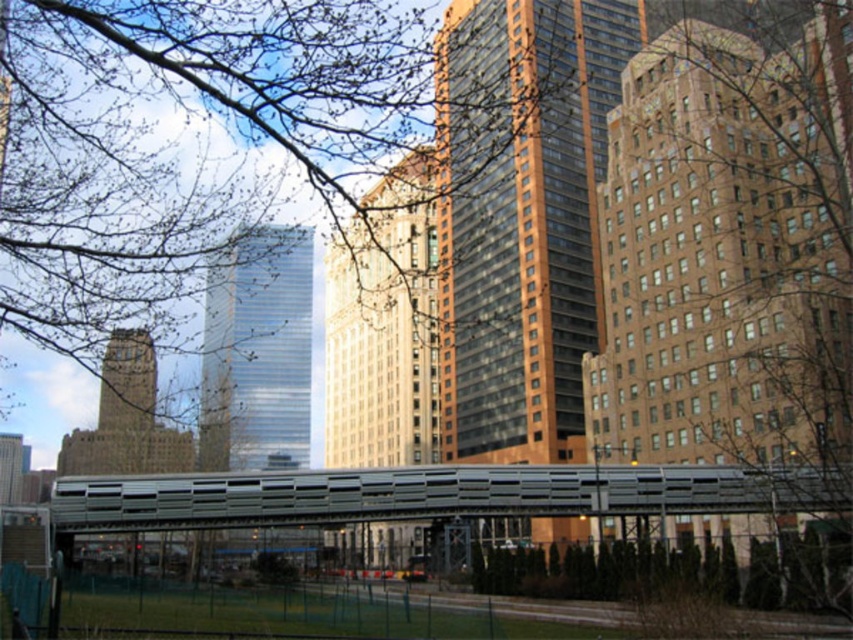
Can you confirm if brown textured tree at center is positioned below green grass at lower center?

No, brown textured tree at center is not below green grass at lower center.

Is brown textured tree at center taller than green grass at lower center?

Yes, brown textured tree at center is taller than green grass at lower center.

At what (x,y) coordinates should I click in order to perform the action: click on brown textured tree at center. Please return your answer as a coordinate pair (x, y). Looking at the image, I should click on (734, 246).

Image resolution: width=853 pixels, height=640 pixels. I want to click on brown textured tree at center, so click(734, 246).

Does brown textured tree at center have a greater width compared to bare branches at upper center?

No, brown textured tree at center is not wider than bare branches at upper center.

Is brown textured tree at center to the left of bare branches at upper center from the viewer's perspective?

Incorrect, brown textured tree at center is not on the left side of bare branches at upper center.

Measure the distance between point [780,100] and camera.

They are 300.85 feet apart.

Identify the location of brown textured tree at center. The width and height of the screenshot is (853, 640). (734, 246).

Is bare branches at upper center above metallic gray bridge at center?

Correct, bare branches at upper center is located above metallic gray bridge at center.

Is point (224, 12) in front of point (456, 488)?

Yes, point (224, 12) is in front of point (456, 488).

Who is more forward, (61,1) or (129,490)?

Answer: Point (61,1) is more forward.

The width and height of the screenshot is (853, 640). What are the coordinates of `bare branches at upper center` in the screenshot? It's located at (177, 164).